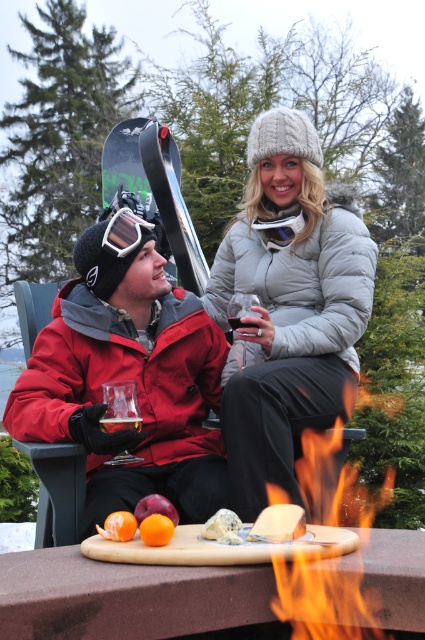
Does white fluffy hat at upper center appear over purple matte apple at center?

Correct, white fluffy hat at upper center is located above purple matte apple at center.

The image size is (425, 640). In order to click on white fluffy hat at upper center in this screenshot , I will do click(x=288, y=307).

Who is lower down, flamematerial/texture at right or translucent glass at center?

flamematerial/texture at right

In the scene shown: Is the position of flamematerial/texture at right more distant than that of translucent glass at center?

Yes, it is behind translucent glass at center.

Is point (303, 630) less distant than point (257, 326)?

Yes, it is in front of point (257, 326).

The height and width of the screenshot is (640, 425). I want to click on flamematerial/texture at right, so click(323, 600).

Does matte red jacket at center have a lesser width compared to translucent glass at center?

No.

Image resolution: width=425 pixels, height=640 pixels. I want to click on matte red jacket at center, so click(214, 340).

Find the location of a particular element. Image resolution: width=425 pixels, height=640 pixels. matte red jacket at center is located at coordinates (214, 340).